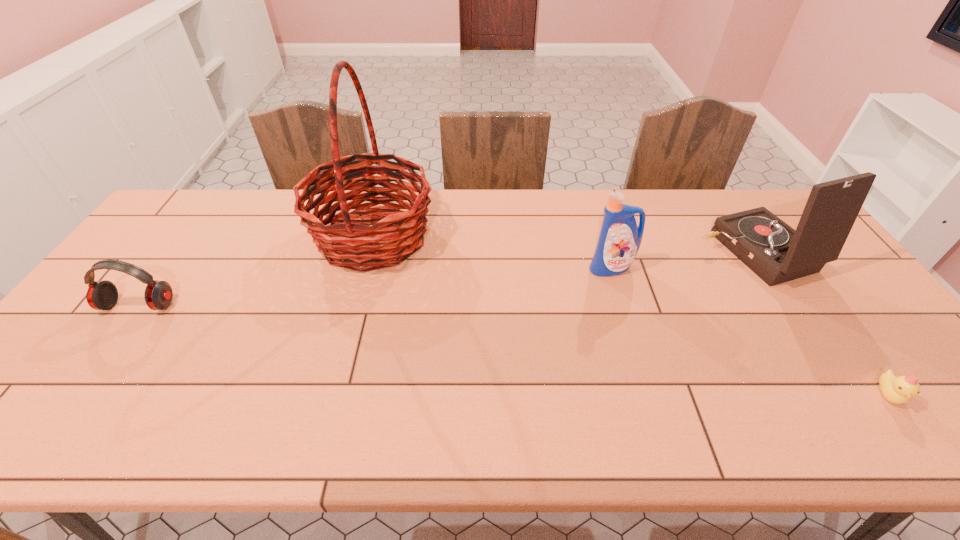
Locate an element on the screen. free space between the detergent and the phonograph record is located at coordinates (683, 261).

Locate an element on the screen. The width and height of the screenshot is (960, 540). blank region between the third tallest object and the leftmost object is located at coordinates (375, 287).

Image resolution: width=960 pixels, height=540 pixels. I want to click on free spot between the fourth shortest object and the third object from left to right, so click(683, 261).

This screenshot has height=540, width=960. Find the location of `free space between the third object from left to right and the second object from left to right`. free space between the third object from left to right and the second object from left to right is located at coordinates (492, 252).

Identify the location of free area in between the tallest object and the third tallest object. This screenshot has height=540, width=960. pos(492,252).

The width and height of the screenshot is (960, 540). Identify the location of object that is the third closest to the third tallest object. (898, 390).

Locate an element on the screen. This screenshot has width=960, height=540. object that is the third closest to the third shortest object is located at coordinates (898, 390).